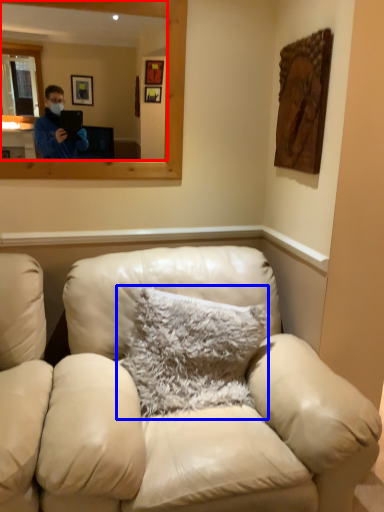
Question: Which object appears closest to the camera in this image, mirror (highlighted by a red box) or pillow (highlighted by a blue box)?

Choices:
 (A) mirror
 (B) pillow

Answer: (B)